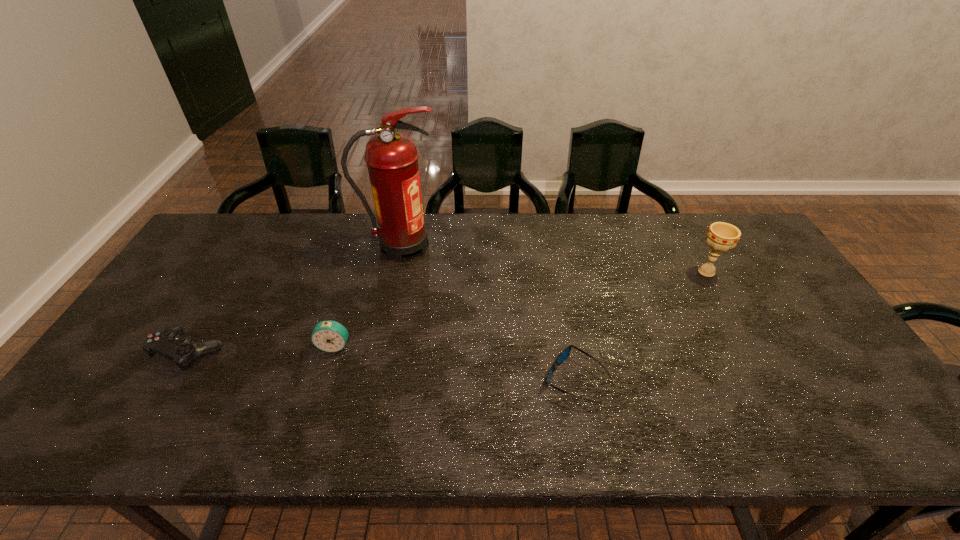
Image resolution: width=960 pixels, height=540 pixels. I want to click on the tallest object, so click(392, 158).

Where is `fire extinguisher`? Image resolution: width=960 pixels, height=540 pixels. fire extinguisher is located at coordinates (392, 158).

At what (x,y) coordinates should I click in order to perform the action: click on the second farthest object. Please return your answer as a coordinate pair (x, y). Looking at the image, I should click on (720, 237).

At what (x,y) coordinates should I click in order to perform the action: click on the rightmost object. Please return your answer as a coordinate pair (x, y). Image resolution: width=960 pixels, height=540 pixels. Looking at the image, I should click on (720, 237).

Identify the location of alarm clock. (330, 336).

This screenshot has width=960, height=540. What are the coordinates of `control` in the screenshot? It's located at pos(169,342).

At what (x,y) coordinates should I click in order to perform the action: click on the second shortest object. Please return your answer as a coordinate pair (x, y). This screenshot has width=960, height=540. Looking at the image, I should click on (169, 342).

Where is `the shortest object`? This screenshot has width=960, height=540. the shortest object is located at coordinates (564, 354).

Find the location of a particular element. The image size is (960, 540). sunglasses is located at coordinates (564, 354).

Where is `free space located on the front-facing side of the farthest object`? The image size is (960, 540). free space located on the front-facing side of the farthest object is located at coordinates (511, 246).